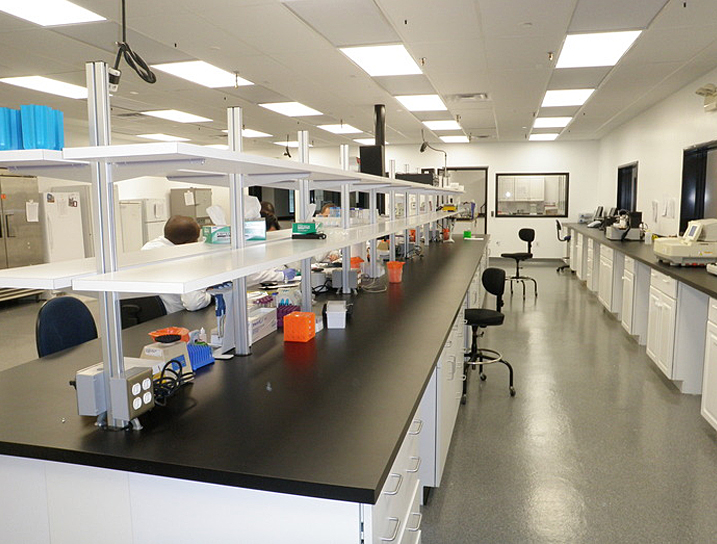
Image resolution: width=717 pixels, height=544 pixels. Find the location of `window`. window is located at coordinates (711, 190), (631, 191), (533, 197).